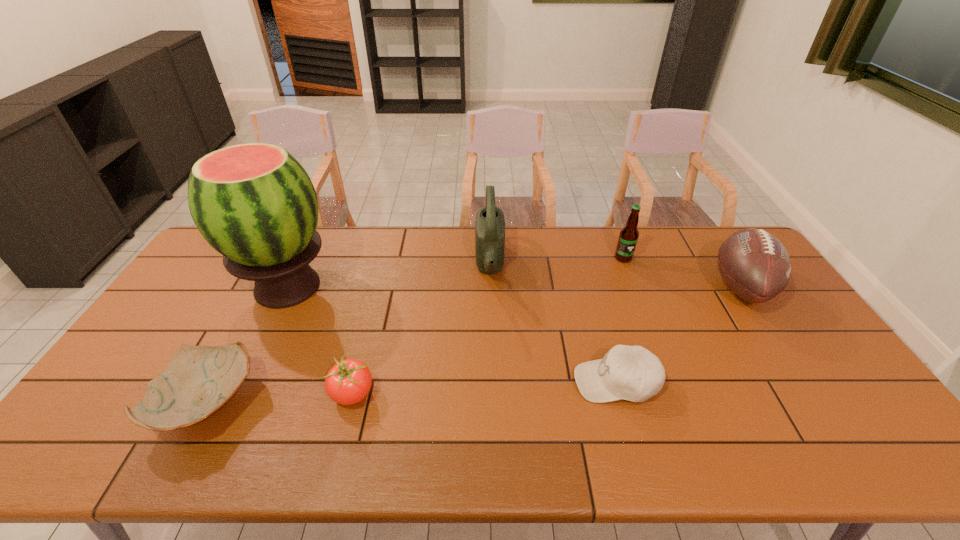
This screenshot has width=960, height=540. Find the location of `beer bottle present at the far edge`. beer bottle present at the far edge is located at coordinates (628, 237).

Where is `football (American) that is positioned at the far edge`? The image size is (960, 540). football (American) that is positioned at the far edge is located at coordinates (755, 265).

The height and width of the screenshot is (540, 960). What are the coordinates of `object positioned at the near edge` in the screenshot? It's located at (198, 380).

You are a GUI agent. You are given a task and a screenshot of the screen. Output one action in this format:
    pyautogui.click(x=<x>, y=<y>)
    Task: Click on the object present at the right edge
    Image resolution: width=960 pixels, height=540 pixels.
    Given the screenshot: What is the action you would take?
    pyautogui.click(x=755, y=265)

The height and width of the screenshot is (540, 960). In order to click on object that is at the far right corner in this screenshot , I will do `click(755, 265)`.

Where is `vacant space at the far edge of the desktop`? vacant space at the far edge of the desktop is located at coordinates (682, 237).

The image size is (960, 540). In order to click on free space at the near edge of the desktop in this screenshot , I will do `click(625, 429)`.

The image size is (960, 540). I want to click on vacant space at the right edge of the desktop, so click(809, 387).

You are a GUI agent. You are given a task and a screenshot of the screen. Output one action in this format:
    pyautogui.click(x=<x>, y=<y>)
    Task: Click on the free space that is in between the baseball cap and the fourth object from left to right
    
    Given the screenshot: What is the action you would take?
    pyautogui.click(x=553, y=323)

I want to click on empty space between the fourth object from left to right and the rightmost object, so click(615, 276).